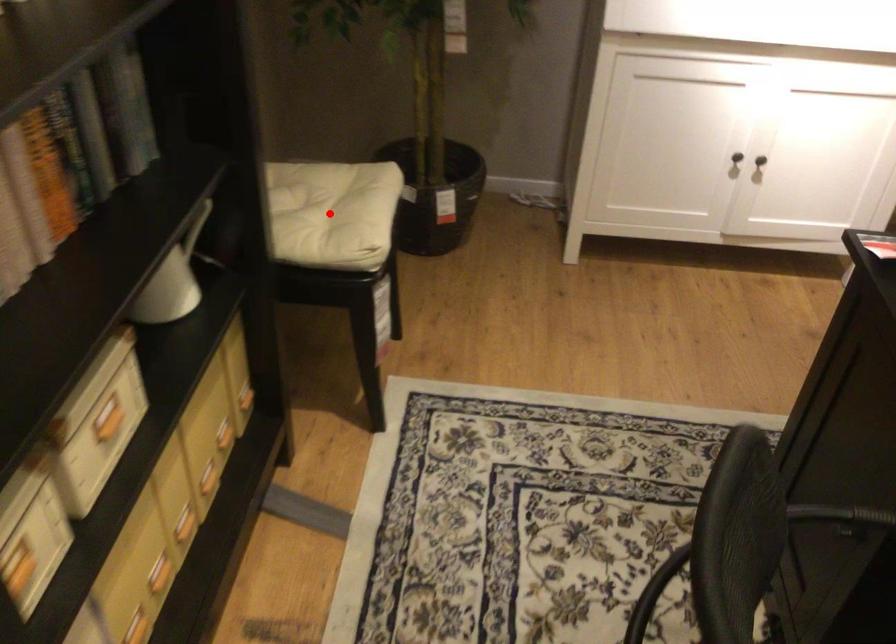
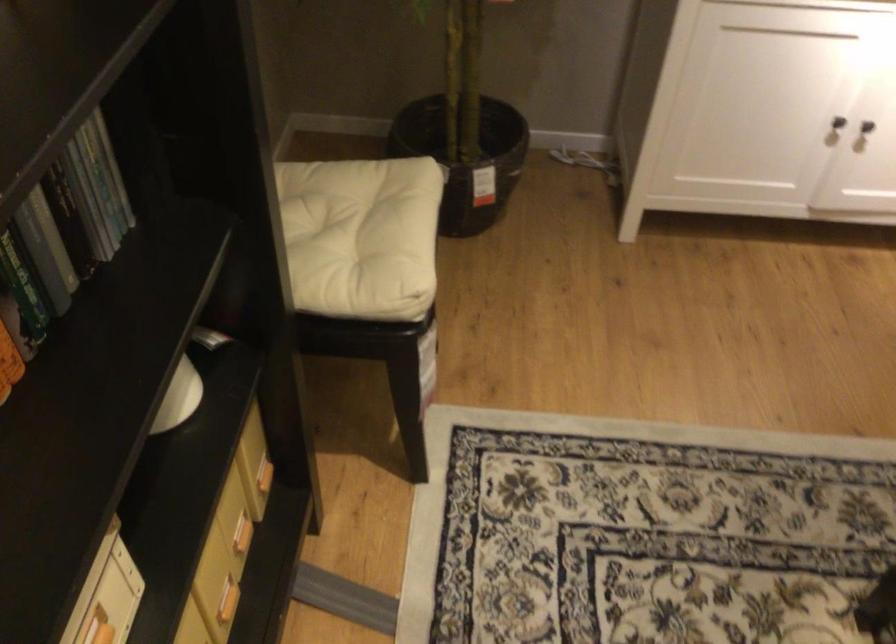
Question: I am providing you with two images of the same scene from different viewpoints. A red point is shown in image1. For the corresponding object point in image2, is it positioned nearer or farther from the camera?

Choices:
 (A) Nearer
 (B) Farther

Answer: (A)